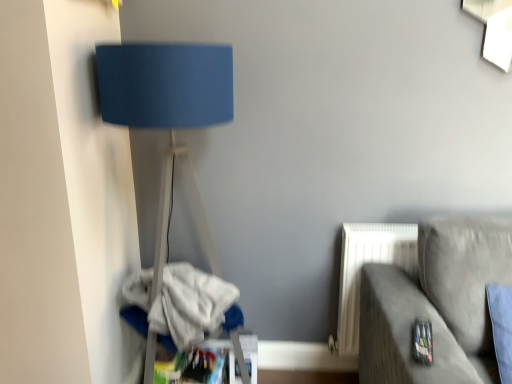
At what (x,y) coordinates should I click in order to perform the action: click on matte blue lampshade at left. Please return your answer as a coordinate pair (x, y). The width and height of the screenshot is (512, 384). Looking at the image, I should click on (168, 112).

The height and width of the screenshot is (384, 512). What do you see at coordinates (436, 304) in the screenshot?
I see `suede gray couch at lower right` at bounding box center [436, 304].

What are the coordinates of `white cotton laundry at lower left` in the screenshot? It's located at (181, 305).

How distant is white cotton laundry at lower left from matte blue lampshade at left?

white cotton laundry at lower left is 11.43 inches away from matte blue lampshade at left.

Is point (206, 331) farther from viewer compared to point (215, 68)?

That is True.

Is white cotton laundry at lower left outside of matte blue lampshade at left?

No, most part of white cotton laundry at lower left lies within matte blue lampshade at left.

Which object is thinner, white cotton laundry at lower left or matte blue lampshade at left?

white cotton laundry at lower left.

Looking at this image, how different are the orientations of matte blue lampshade at left and white cotton laundry at lower left in degrees?

The angular difference between matte blue lampshade at left and white cotton laundry at lower left is 90 degrees.

Which of these two, matte blue lampshade at left or white cotton laundry at lower left, stands shorter?

white cotton laundry at lower left.

In the scene shown: From the image's perspective, which one is positioned lower, matte blue lampshade at left or white cotton laundry at lower left?

From the image's view, white cotton laundry at lower left is below.

Considering the sizes of objects matte blue lampshade at left and white cotton laundry at lower left in the image provided, who is wider, matte blue lampshade at left or white cotton laundry at lower left?

matte blue lampshade at left is wider.

From the image's perspective, which is above, white cotton laundry at lower left or suede gray couch at lower right?

white cotton laundry at lower left is shown above in the image.

Between white cotton laundry at lower left and suede gray couch at lower right, which one appears on the right side from the viewer's perspective?

Positioned to the right is suede gray couch at lower right.

From a real-world perspective, between white cotton laundry at lower left and suede gray couch at lower right, who is vertically lower?

suede gray couch at lower right.

Where is `lamp above the suede gray couch at lower right (from a real-world perspective)`? lamp above the suede gray couch at lower right (from a real-world perspective) is located at coordinates (168, 112).

From a real-world perspective, which is physically below, suede gray couch at lower right or matte blue lampshade at left?

suede gray couch at lower right is physically lower.

Is suede gray couch at lower right closer to camera compared to matte blue lampshade at left?

Yes, suede gray couch at lower right is closer to the camera.

From the image's perspective, which one is positioned higher, suede gray couch at lower right or matte blue lampshade at left?

From the image's view, matte blue lampshade at left is above.

Locate an element on the screen. This screenshot has height=384, width=512. studio couch below the white cotton laundry at lower left (from the image's perspective) is located at coordinates (436, 304).

Is suede gray couch at lower right positioned with its back to white cotton laundry at lower left?

That's not correct — suede gray couch at lower right is not looking away from white cotton laundry at lower left.

From the image's perspective, is suede gray couch at lower right above or below white cotton laundry at lower left?

Clearly, from the image's perspective, suede gray couch at lower right is below white cotton laundry at lower left.

Is suede gray couch at lower right taller than white cotton laundry at lower left?

Yes, suede gray couch at lower right is taller than white cotton laundry at lower left.

From a real-world perspective, is matte blue lampshade at left on top of suede gray couch at lower right?

Yes, from a real-world perspective, matte blue lampshade at left is above suede gray couch at lower right.

From the image's perspective, is matte blue lampshade at left above or below suede gray couch at lower right?

From the image's perspective, matte blue lampshade at left appears above suede gray couch at lower right.

From their relative heights in the image, would you say matte blue lampshade at left is taller or shorter than suede gray couch at lower right?

Clearly, matte blue lampshade at left is taller compared to suede gray couch at lower right.

The height and width of the screenshot is (384, 512). I want to click on lamp behind the suede gray couch at lower right, so click(168, 112).

Find the location of a particular element. This screenshot has width=512, height=384. laundry on the left side of matte blue lampshade at left is located at coordinates (181, 305).

Identify the location of laundry below the matte blue lampshade at left (from a real-world perspective). The height and width of the screenshot is (384, 512). coord(181,305).

Which object lies nearer to the anchor point matte blue lampshade at left, suede gray couch at lower right or white cotton laundry at lower left?

white cotton laundry at lower left is closer to matte blue lampshade at left.

Looking at the image, which one is located further to suede gray couch at lower right, white cotton laundry at lower left or matte blue lampshade at left?

matte blue lampshade at left is further to suede gray couch at lower right.

Which object lies nearer to the anchor point matte blue lampshade at left, white cotton laundry at lower left or suede gray couch at lower right?

The object closer to matte blue lampshade at left is white cotton laundry at lower left.

Considering their positions, is matte blue lampshade at left positioned further to suede gray couch at lower right than white cotton laundry at lower left?

matte blue lampshade at left is further to suede gray couch at lower right.

Considering their positions, is matte blue lampshade at left positioned closer to white cotton laundry at lower left than suede gray couch at lower right?

matte blue lampshade at left.

Consider the image. Estimate the real-world distances between objects in this image. Which object is further from white cotton laundry at lower left, suede gray couch at lower right or matte blue lampshade at left?

suede gray couch at lower right lies further to white cotton laundry at lower left than the other object.

What are the coordinates of `lamp between white cotton laundry at lower left and suede gray couch at lower right in the horizontal direction` in the screenshot? It's located at pyautogui.click(x=168, y=112).